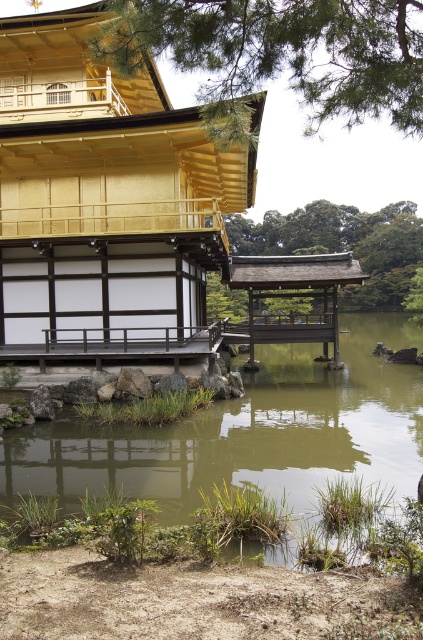
Which is more to the left, golden polished wood temple at upper left or green grassy water at center?

From the viewer's perspective, golden polished wood temple at upper left appears more on the left side.

Is golden polished wood temple at upper left bigger than green grassy water at center?

Incorrect, golden polished wood temple at upper left is not larger than green grassy water at center.

Image resolution: width=423 pixels, height=640 pixels. In order to click on golden polished wood temple at upper left in this screenshot , I will do `click(104, 202)`.

You are a GUI agent. You are given a task and a screenshot of the screen. Output one action in this format:
    pyautogui.click(x=<x>, y=<y>)
    Task: Click on the golden polished wood temple at upper left
    This screenshot has height=640, width=423.
    Given the screenshot: What is the action you would take?
    pyautogui.click(x=104, y=202)